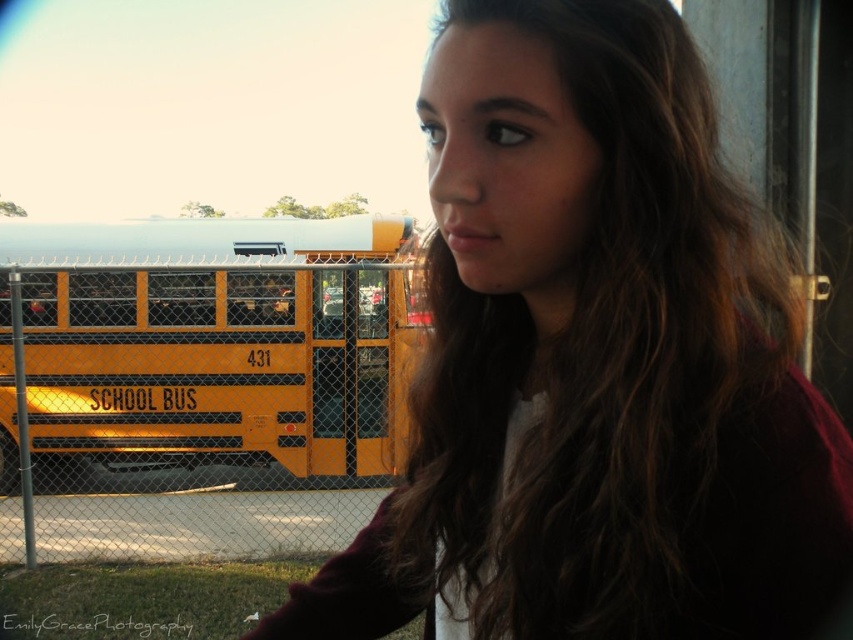
You are a photographer trying to capture both the matte yellow school bus at left and the yellow matte school bus at left in a single shot. However, you notice that one of them appears smaller in the frame. Which school bus takes up less space in the photo?

The matte yellow school bus at left occupies less space than the yellow matte school bus at left, so the matte yellow school bus at left takes up less space in the photo.

You are a photographer trying to capture a clear shot of the matte yellow school bus at left and the yellow matte school bus at left. However, you notice something confusing about their positions. What is the issue with their arrangement?

The matte yellow school bus at left is positioned to the right of the yellow matte school bus at left, which creates a contradiction because both are labeled as being on the left but one is placed to the right of the other.

You are standing at the origin point in the image. A point is marked at coordinates point (593, 362). Which object is located at that point?

The point (593, 362) marks the matte yellow school bus at left.